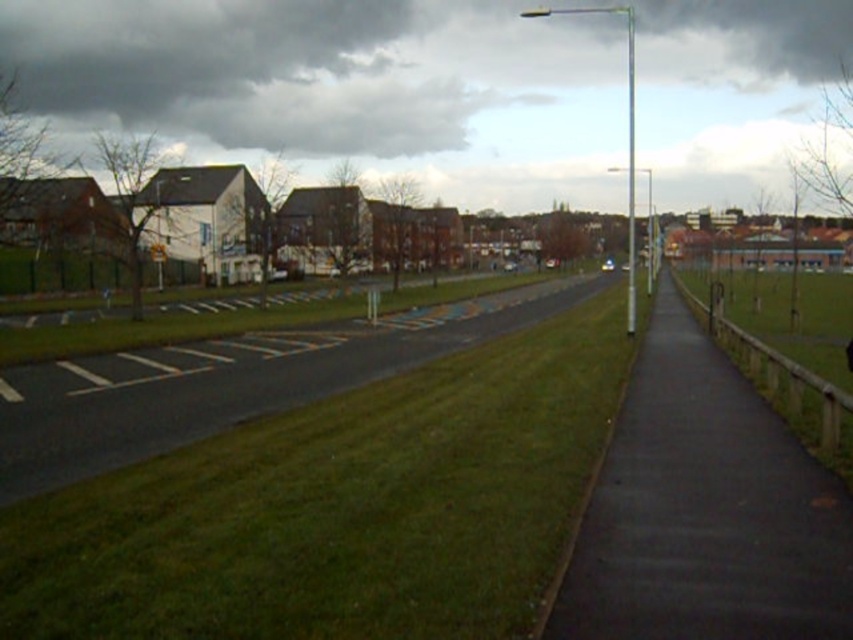
Is green grass at center thinner than black asphalt sidewalk at right?

No, green grass at center is not thinner than black asphalt sidewalk at right.

Can you confirm if green grass at center is shorter than black asphalt sidewalk at right?

No, green grass at center is not shorter than black asphalt sidewalk at right.

Which is behind, point (297, 564) or point (654, 378)?

The point (654, 378) is behind.

Where is `green grass at center`? The width and height of the screenshot is (853, 640). green grass at center is located at coordinates (335, 508).